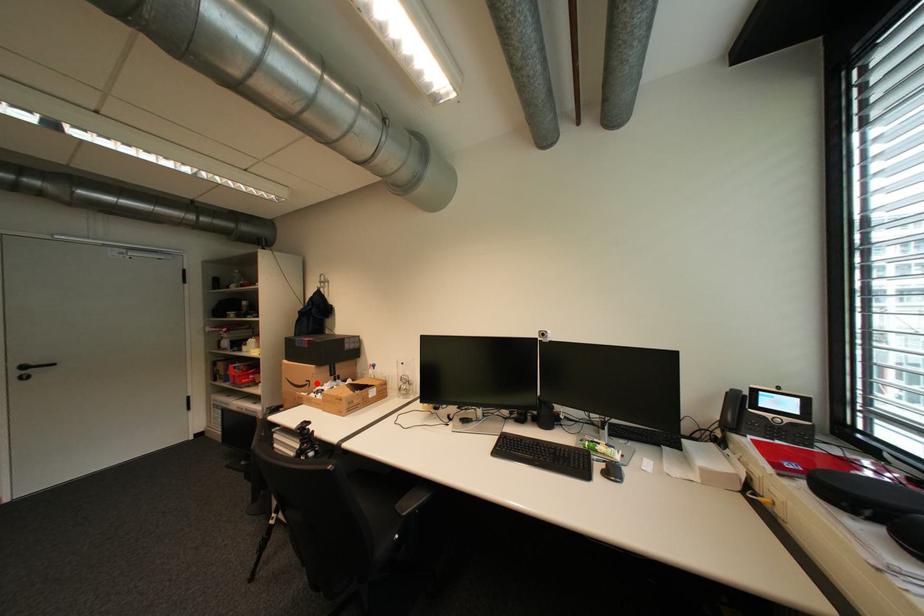
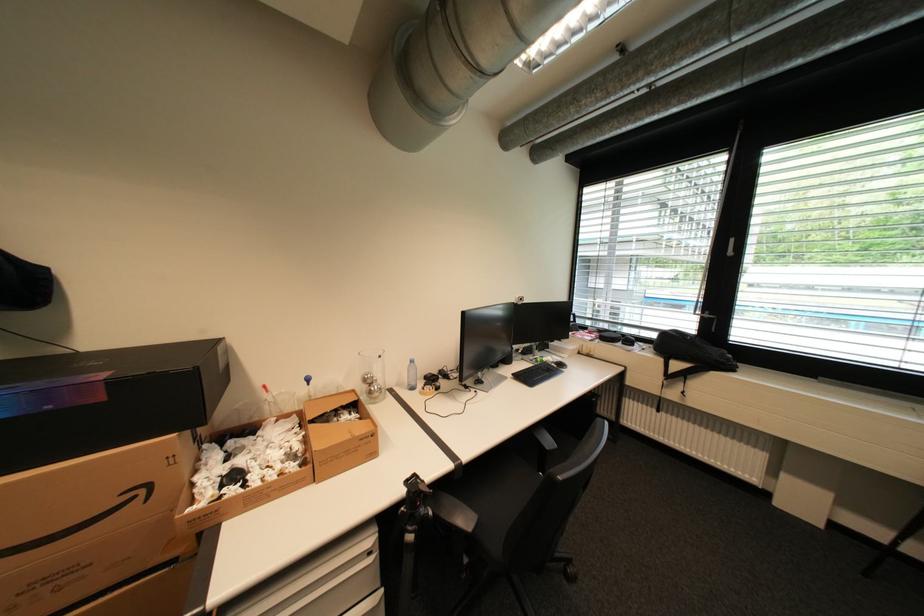
Where in the second image is the point corresponding to the highlighted location from the first image?

(151, 491)